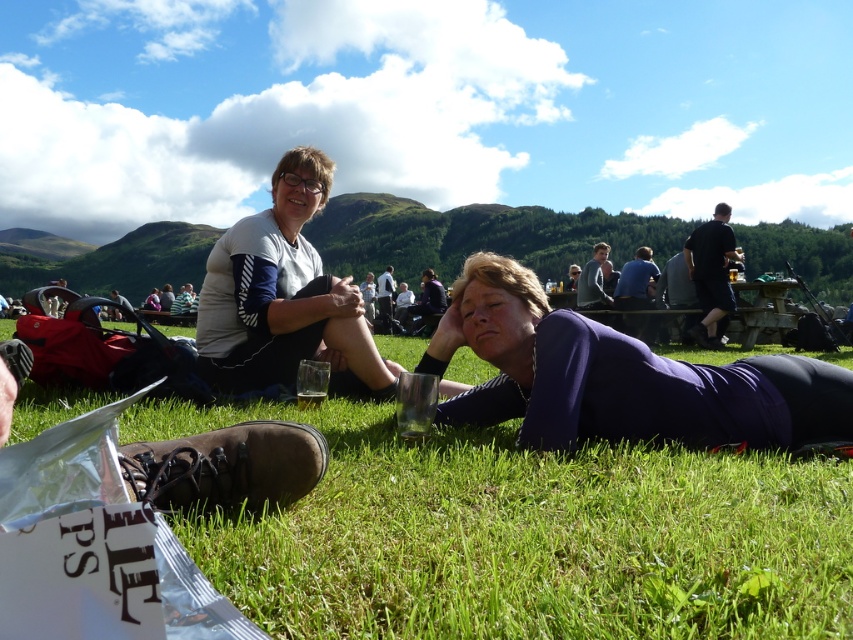
You are standing at the center of the image and want to reach the white fabric shirt at upper left. Which direction should you move in to get closer to it?

The white fabric shirt at upper left is located at point (283, 298), so you should move towards the upper left direction to get closer to it.

You are a photographer trying to capture a closeup of both the gray sweater at center and the light gray fabric jacket at center. Since you want to ensure both items are fully visible in the frame, which one should you focus on first to avoid cropping the edges?

The gray sweater at center has a lesser width compared to the light gray fabric jacket at center, so you should focus on capturing the light gray fabric jacket at center first since it is wider and requires more space to fit entirely in the frame.